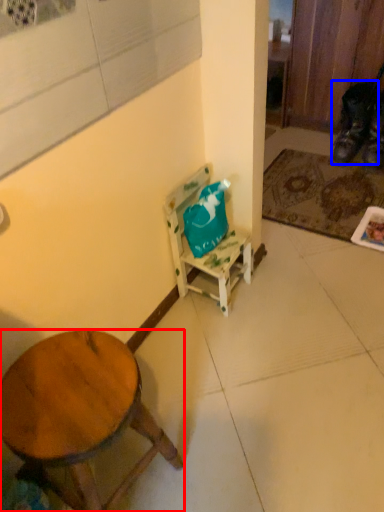
Question: Among these objects, which one is nearest to the camera, desk (highlighted by a red box) or shoe (highlighted by a blue box)?

Choices:
 (A) desk
 (B) shoe

Answer: (A)